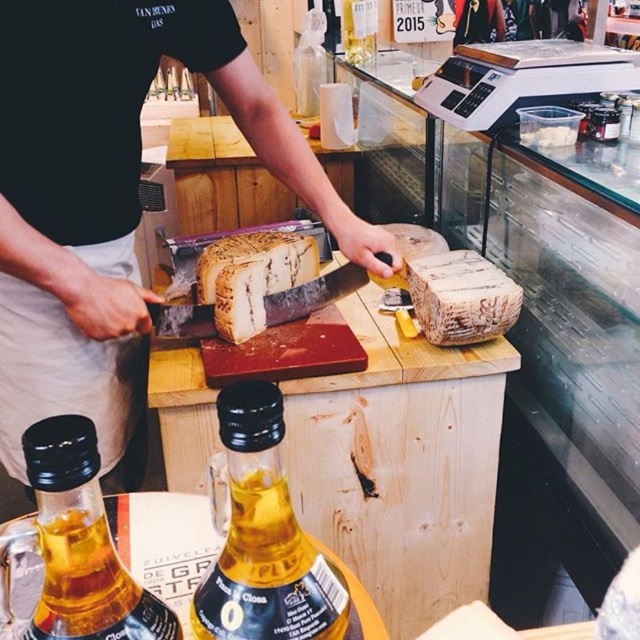
You are a customer in the cheese shop and want to place both bottles on the counter so they are exactly 12 inches apart. Can you move the translucent glass bottle at center to achieve this?

The bottles are currently 16.16 inches apart, so you can move the translucent glass bottle at center closer to the other bottle to reduce the distance to 12 inches.